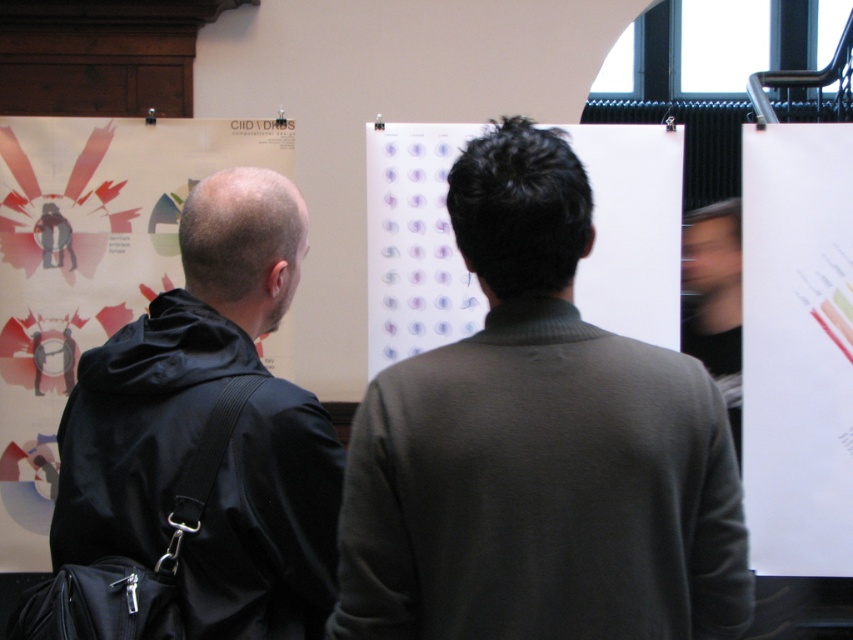
You are a person with a height of 1.7 meters. You are standing in front of the dark green sweater at center. The wall with the posters is 2.5 meters away from you. Can you reach the top of the poster on the far left?

The dark green sweater at center is 1.29 meters away from you. The wall with the posters is 2.5 meters away from you. Since the distance between you and the wall is greater than the distance between you and the sweater, you can reach the top of the poster on the far left if your arm length plus height allows. However, without knowing your arm length, it is impossible to determine.